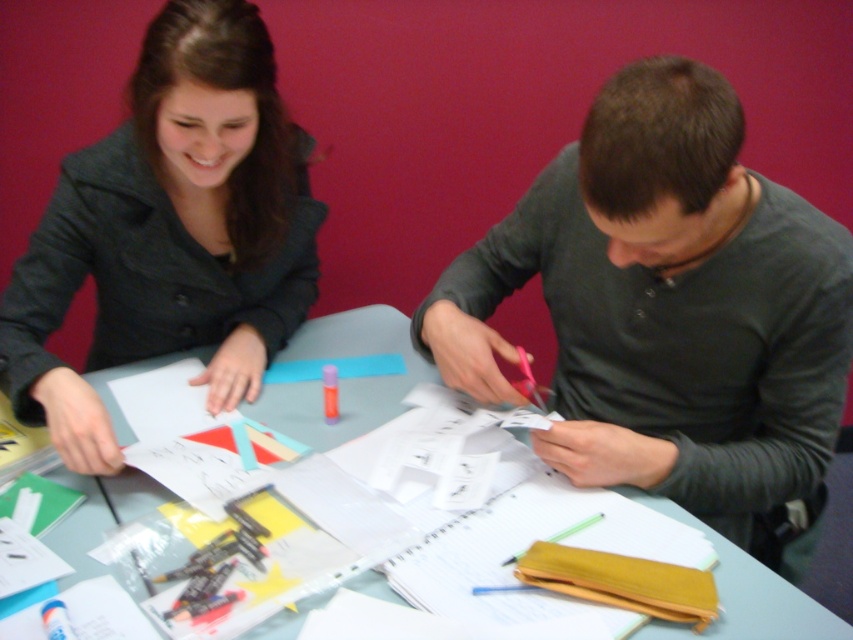
You are standing in front of the table and want to place a small object on the surface. Which object, the matte gray coat at upper left or the light blue plastic table at center, is the correct surface to place it on?

The light blue plastic table at center is the correct surface to place the small object because it is a table, while the matte gray coat at upper left is likely hanging or placed above and not suitable for placing items on its surface.

You are standing in front of the table and want to place a small object on the table. Which of the two points, point (610, 115) or point (717, 532), is closer to you?

Point (610, 115) is closer to the viewer than point (717, 532), so you should place the object there if you want it nearer to you.

What is the 2D coordinate of the dark gray shirt at center?

The dark gray shirt at center is located at the 2D coordinate point of (x=669, y=310).